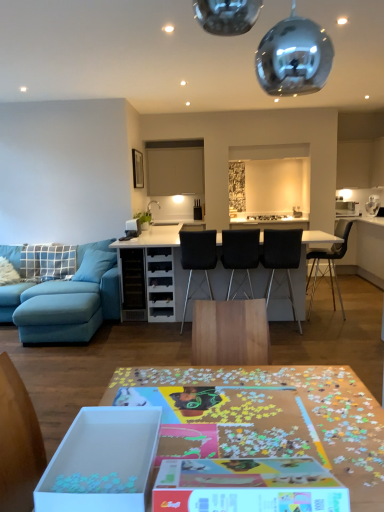
Question: Relative to blue fabric pillow at left, which is the first pillow in left-to-right order, is black fabric chair at center, the 4th chair viewed from the right, in front or behind?

Choices:
 (A) front
 (B) behind

Answer: (A)

Question: Considering the positions of black fabric chair at center, the 4th chair viewed from the right, and blue fabric pillow at left, which is the first pillow in left-to-right order, in the image, is black fabric chair at center, the 4th chair viewed from the right, wider or thinner than blue fabric pillow at left, which is the first pillow in left-to-right order,?

Choices:
 (A) thin
 (B) wide

Answer: (B)

Question: Which object is the farthest from the blue fabric pillow at left, marked as the second pillow in a right-to-left arrangement?

Choices:
 (A) black fabric chair at center, positioned as the first chair in left-to-right order
 (B) velvet blue couch at left
 (C) white glossy table at center, arranged as the 2th table when viewed from the front
 (D) black matte chair at center, placed as the third chair when sorted from right to left
 (E) wooden puzzle pieces at center, which is the second table in back-to-front order

Answer: (E)

Question: Based on their relative distances, which object is farther from the black leather chair at center, placed as the 1th chair when sorted from right to left?

Choices:
 (A) white cardboard box at lower left
 (B) blue fabric pillow at left, which is the first pillow in left-to-right order
 (C) velvet blue couch at left
 (D) black fabric chair at center, the 4th chair viewed from the right
 (E) blue fabric pillow at left, which ranks as the first pillow in right-to-left order

Answer: (A)